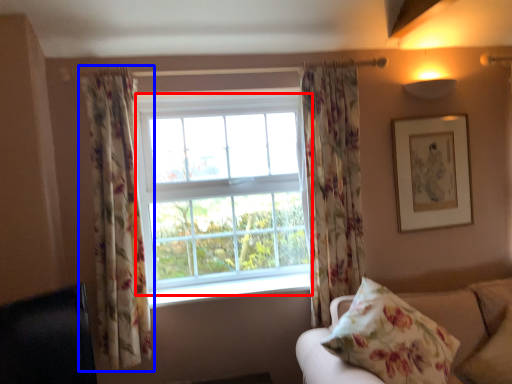
Question: Which point is closer to the camera, bay window (highlighted by a red box) or curtain (highlighted by a blue box)?

Choices:
 (A) bay window
 (B) curtain

Answer: (B)